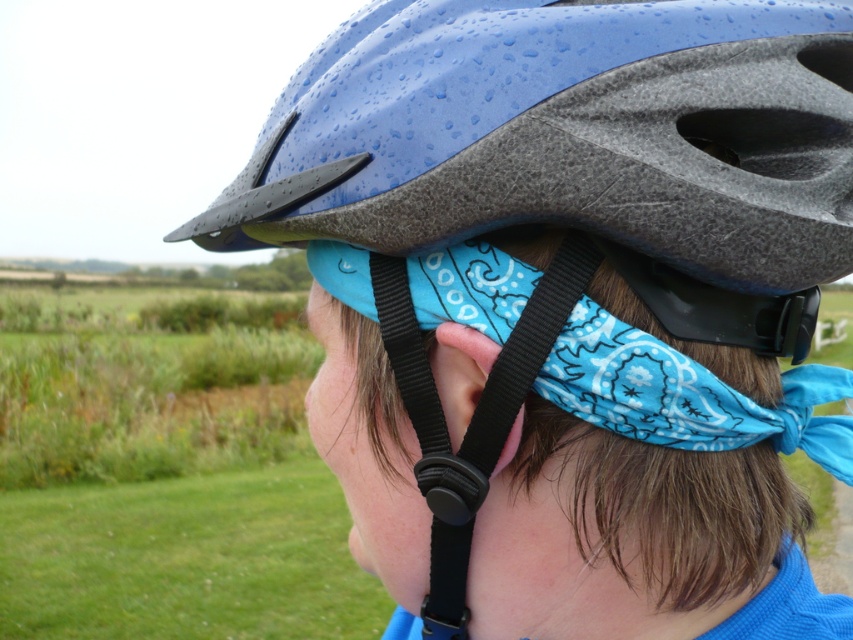
Question: Which of the following is the farthest from the observer?

Choices:
 (A) (492, 472)
 (B) (482, 358)
 (C) (721, 278)
 (D) (740, 301)

Answer: (D)

Question: Is blue matte helmet at center in front of blue bandana at center?

Choices:
 (A) yes
 (B) no

Answer: (A)

Question: Based on their relative distances, which object is farther from the pinksmoothear at center?

Choices:
 (A) blue matte helmet at center
 (B) black matte goggles at center

Answer: (A)

Question: Where is blue matte helmet at center located in relation to pinksmoothear at center in the image?

Choices:
 (A) above
 (B) below

Answer: (A)

Question: Is blue matte helmet at center above blue bandana at center?

Choices:
 (A) no
 (B) yes

Answer: (B)

Question: Which of these objects is positioned farthest from the blue bandana at center?

Choices:
 (A) blue matte helmet at center
 (B) black matte goggles at center

Answer: (A)